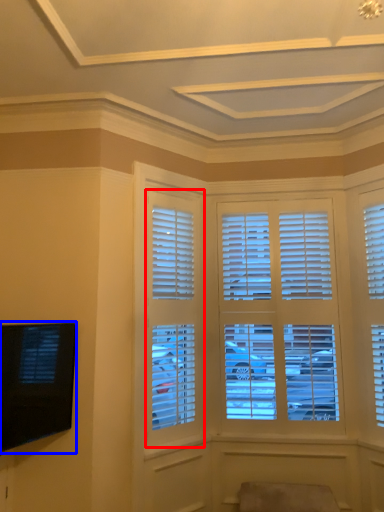
Question: Which point is closer to the camera, window (highlighted by a red box) or television (highlighted by a blue box)?

Choices:
 (A) window
 (B) television

Answer: (B)